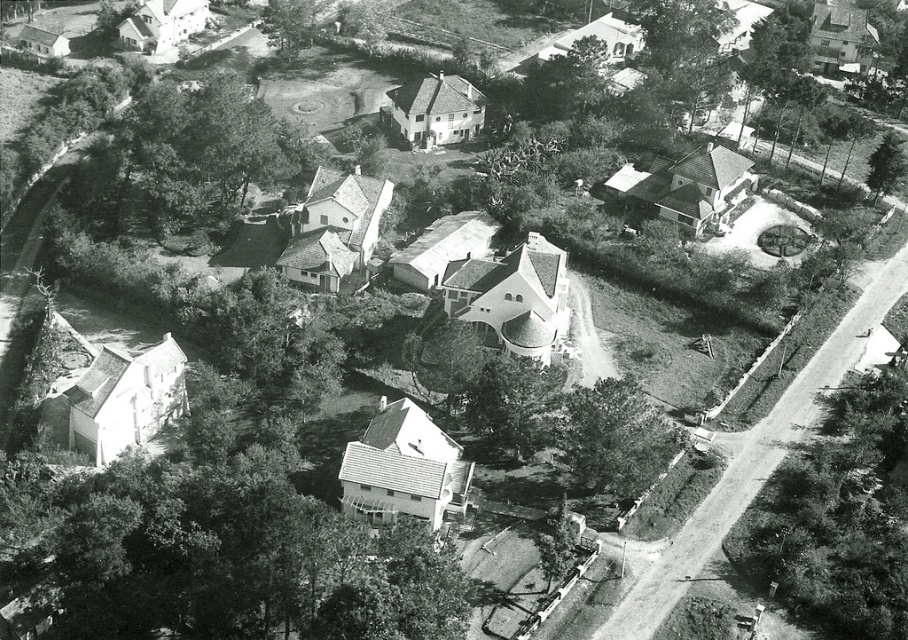
You are standing at the center of the residential area and want to find the dark green leafy tree at lower right. Which direction should you walk from the green leafy tree at center to reach it?

You should walk downward from the green leafy tree at center to reach the dark green leafy tree at lower right because the dark green leafy tree at lower right is located below the green leafy tree at center.

You are a drone operator flying over the residential area shown in the image. You need to deliver a package to the central circular house. To avoid obstacles, you must determine which tree is closer to your current position. Which tree is nearer to you between the dark green leafy tree at lower right and the green leafy tree at center?

The dark green leafy tree at lower right is closer to the viewer than the green leafy tree at center, so it is nearer to your current position.